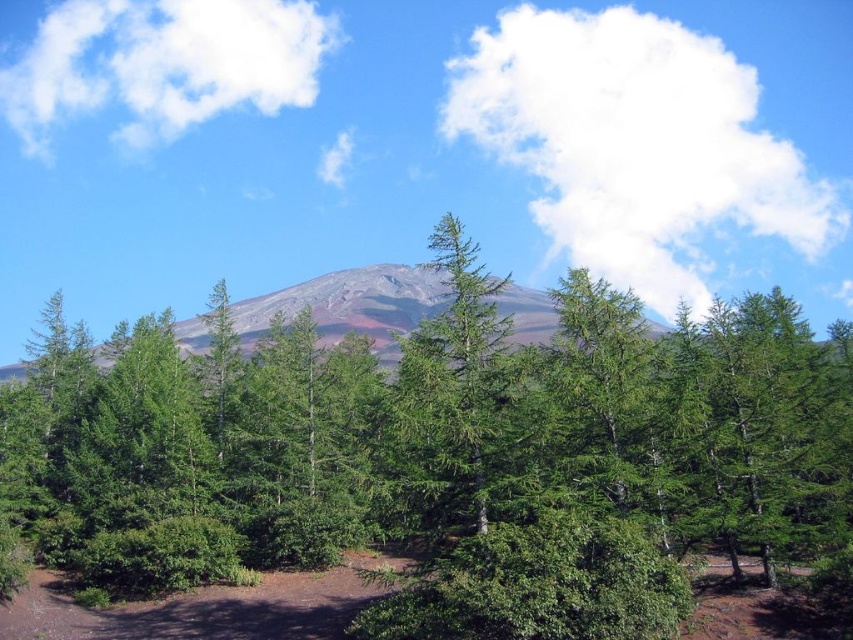
Question: Does green leafy trees at center appear over green matte tree at center?

Choices:
 (A) no
 (B) yes

Answer: (A)

Question: Estimate the real-world distances between objects in this image. Which object is closer to the green leafy trees at center?

Choices:
 (A) green matte tree at center
 (B) matte gray mountain at center

Answer: (A)

Question: Among these objects, which one is farthest from the camera?

Choices:
 (A) green matte tree at center
 (B) green leafy trees at center
 (C) matte gray mountain at center

Answer: (C)

Question: Can you confirm if green leafy trees at center is wider than matte gray mountain at center?

Choices:
 (A) no
 (B) yes

Answer: (A)

Question: Is green leafy trees at center behind matte gray mountain at center?

Choices:
 (A) yes
 (B) no

Answer: (B)

Question: Considering the real-world distances, which object is closest to the matte gray mountain at center?

Choices:
 (A) green leafy trees at center
 (B) green matte tree at center

Answer: (A)